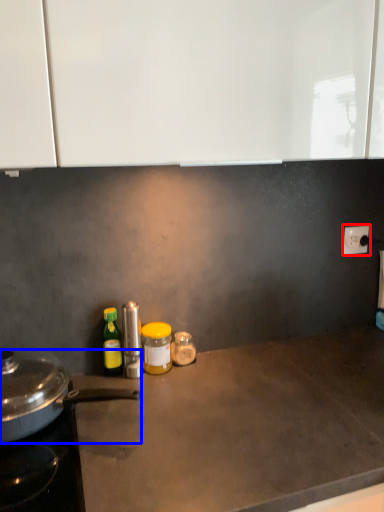
Question: Which of the following is the closest to the observer, electric outlet (highlighted by a red box) or kitchen appliance (highlighted by a blue box)?

Choices:
 (A) electric outlet
 (B) kitchen appliance

Answer: (B)